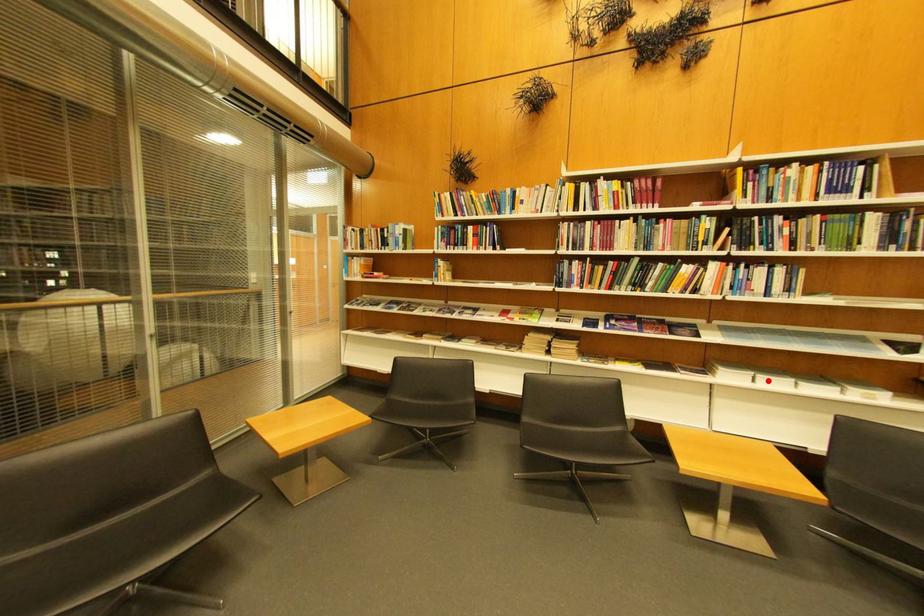
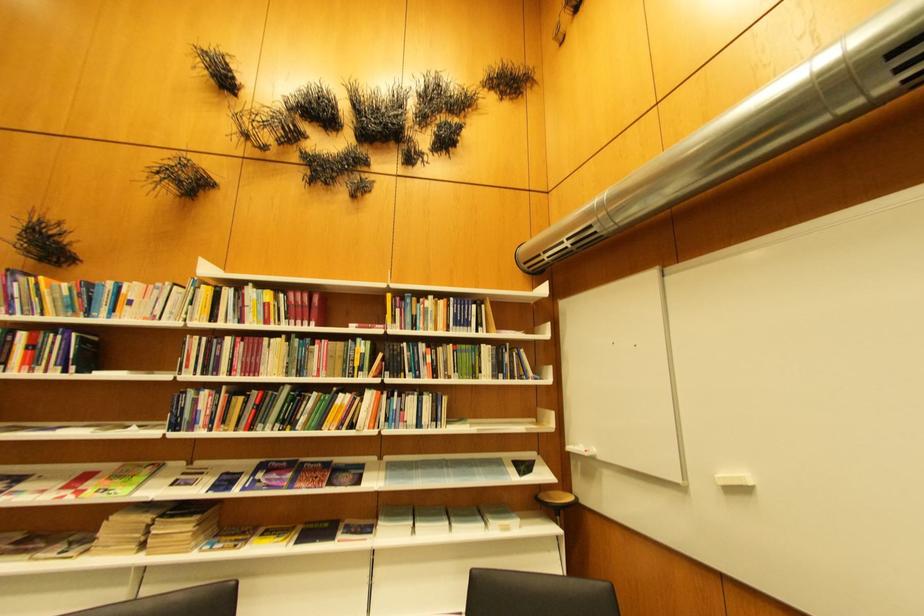
In the second image, find the point that corresponds to the highlighted location in the first image.

(427, 530)